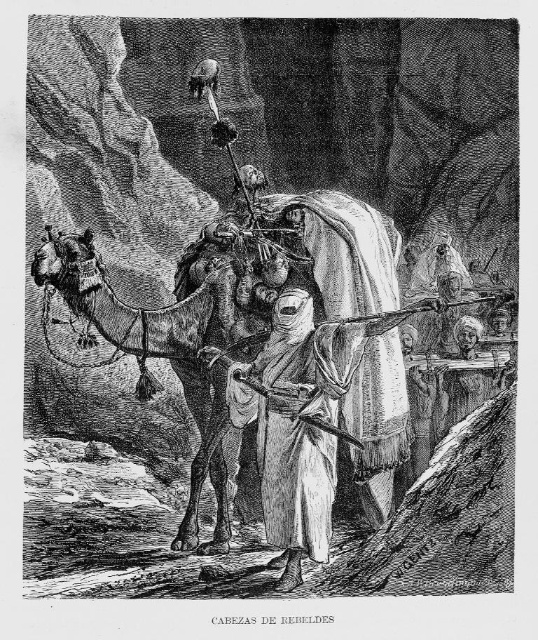
Is brown textured camel at center bigger than white clothed figure at center?

Indeed, brown textured camel at center has a larger size compared to white clothed figure at center.

Looking at this image, who is taller, brown textured camel at center or white clothed figure at center?

With more height is brown textured camel at center.

Is point (208, 352) positioned behind point (295, 554)?

Yes, point (208, 352) is farther from viewer.

Identify the location of brown textured camel at center. Image resolution: width=538 pixels, height=640 pixels. (178, 342).